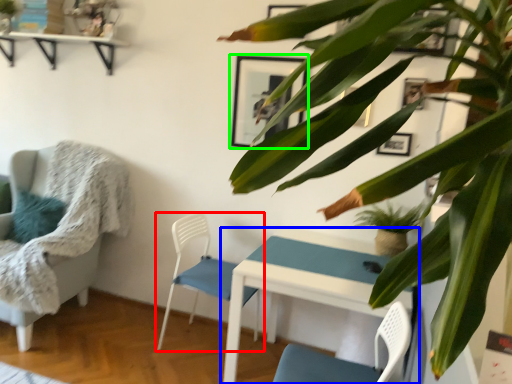
Question: Which is nearer to the chair (highlighted by a red box)? table (highlighted by a blue box) or picture frame (highlighted by a green box).

Choices:
 (A) table
 (B) picture frame

Answer: (A)